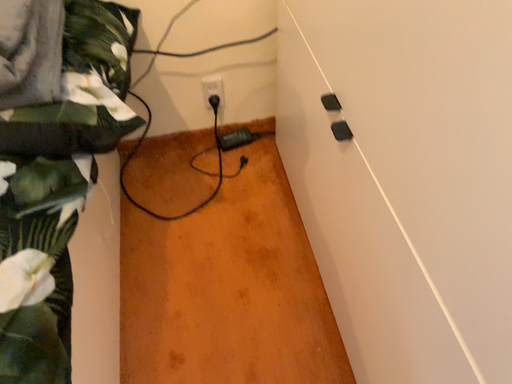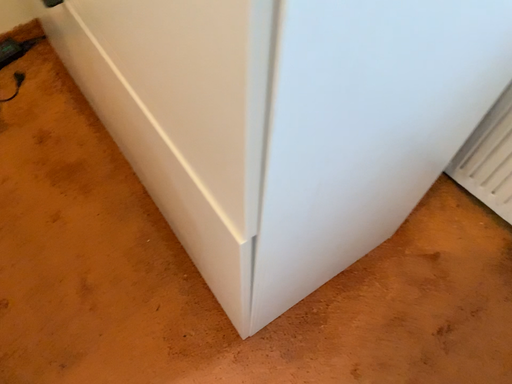
Question: Which way did the camera rotate in the video?

Choices:
 (A) rotated left
 (B) rotated right

Answer: (B)